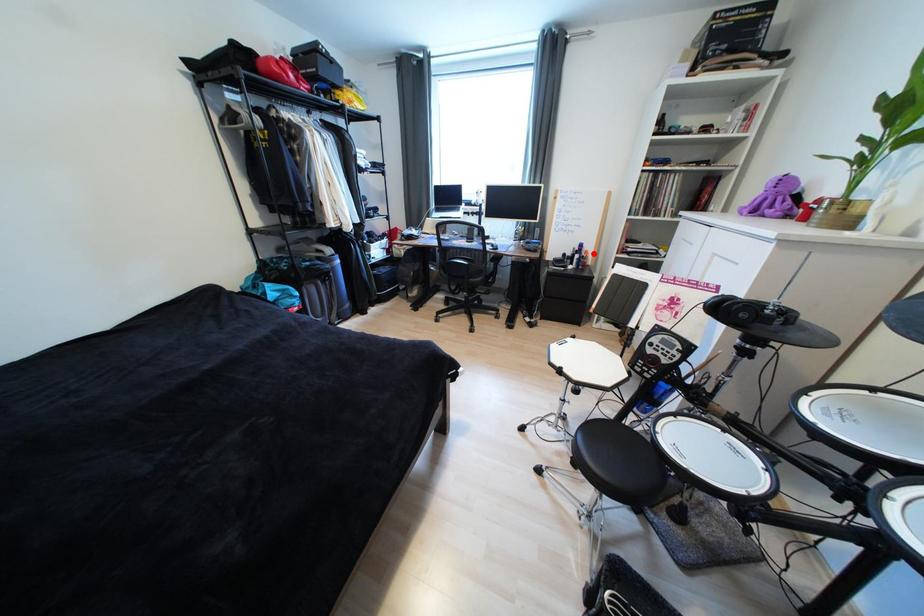
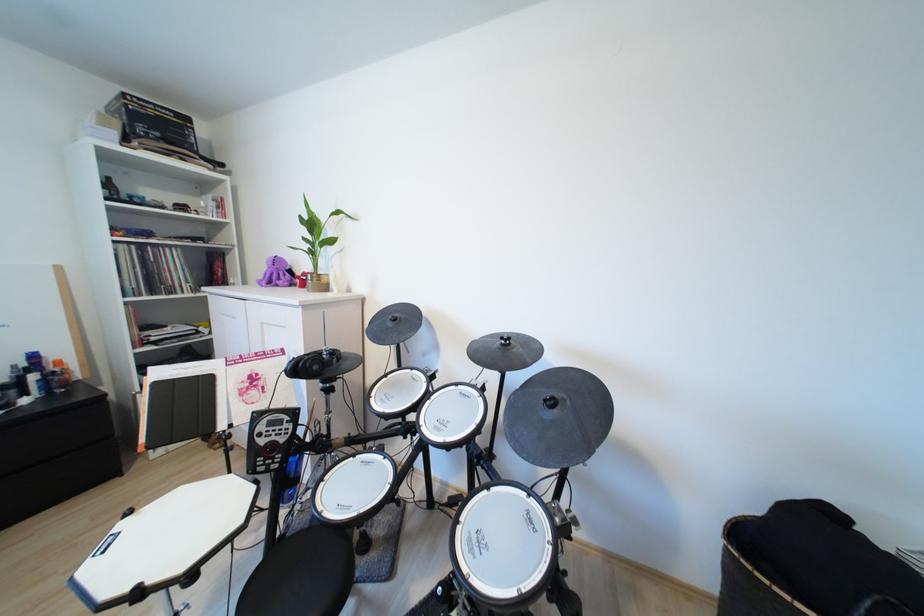
In the second image, find the point that corresponds to the highlighted location in the first image.

(66, 363)